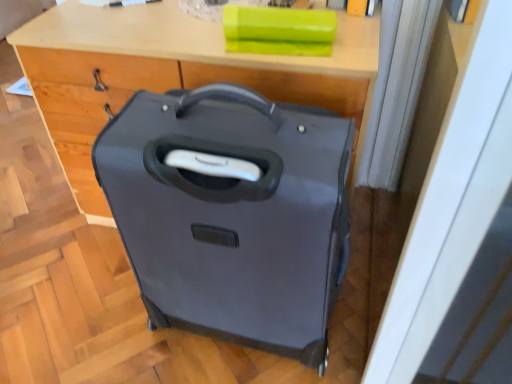
Image resolution: width=512 pixels, height=384 pixels. What are the coordinates of `free spot to the left of matte black suitcase at center` in the screenshot? It's located at (110, 332).